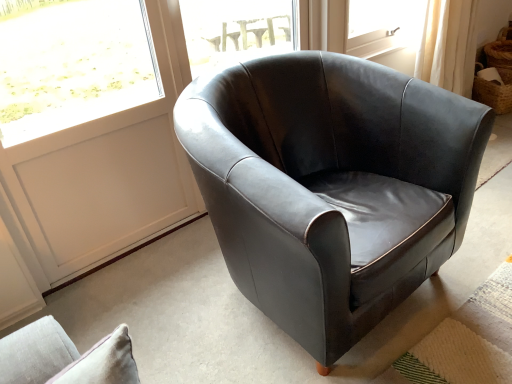
Question: From the image's perspective, is white panel at upper left positioned above or below transparent glass window at center?

Choices:
 (A) above
 (B) below

Answer: (B)

Question: Is point (51, 235) closer or farther from the camera than point (200, 39)?

Choices:
 (A) farther
 (B) closer

Answer: (B)

Question: Considering the real-world distances, which object is farthest from the woven brown basket at upper right?

Choices:
 (A) white panel at upper left
 (B) transparent glass window at center
 (C) matte black armchair at center

Answer: (A)

Question: Considering the real-world distances, which object is closest to the matte black armchair at center?

Choices:
 (A) woven brown basket at upper right
 (B) white panel at upper left
 (C) transparent glass window at center

Answer: (B)